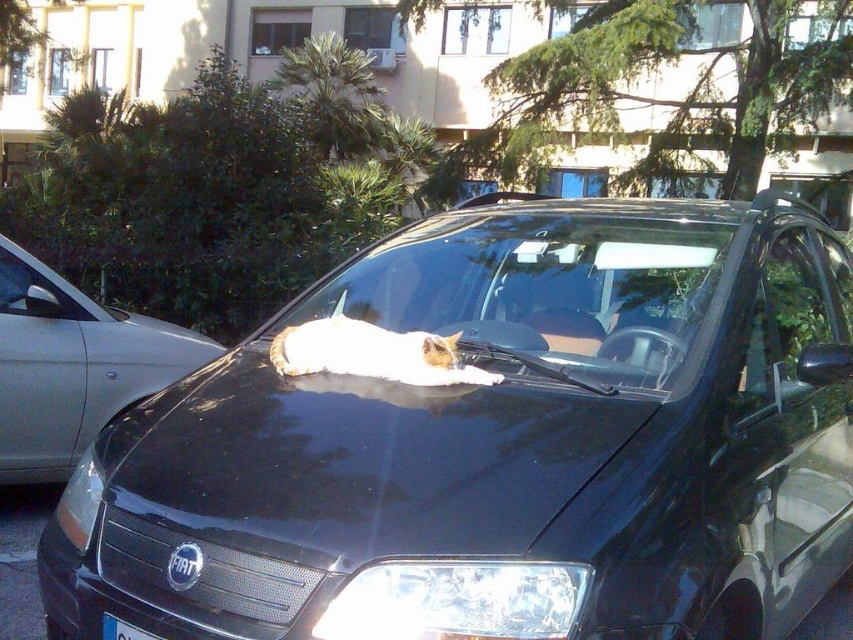
Question: Estimate the real-world distances between objects in this image. Which object is closer to the black glossy car at center?

Choices:
 (A) white plastic license plate at lower center
 (B) clear glass windshield at center
 (C) silver metallic sedan at left
 (D) white fur cat at center

Answer: (D)

Question: Which is farther from the white plastic license plate at lower center?

Choices:
 (A) black glossy car at center
 (B) white fur cat at center
 (C) clear glass windshield at center

Answer: (C)

Question: Does black glossy car at center appear under white fur cat at center?

Choices:
 (A) no
 (B) yes

Answer: (B)

Question: Among these points, which one is nearest to the camera?

Choices:
 (A) (16, 264)
 (B) (151, 636)
 (C) (798, 352)

Answer: (B)

Question: Can you confirm if clear glass windshield at center is positioned above white fur cat at center?

Choices:
 (A) no
 (B) yes

Answer: (B)

Question: Considering the relative positions of white fur cat at center and white plastic license plate at lower center in the image provided, where is white fur cat at center located with respect to white plastic license plate at lower center?

Choices:
 (A) above
 (B) below

Answer: (A)